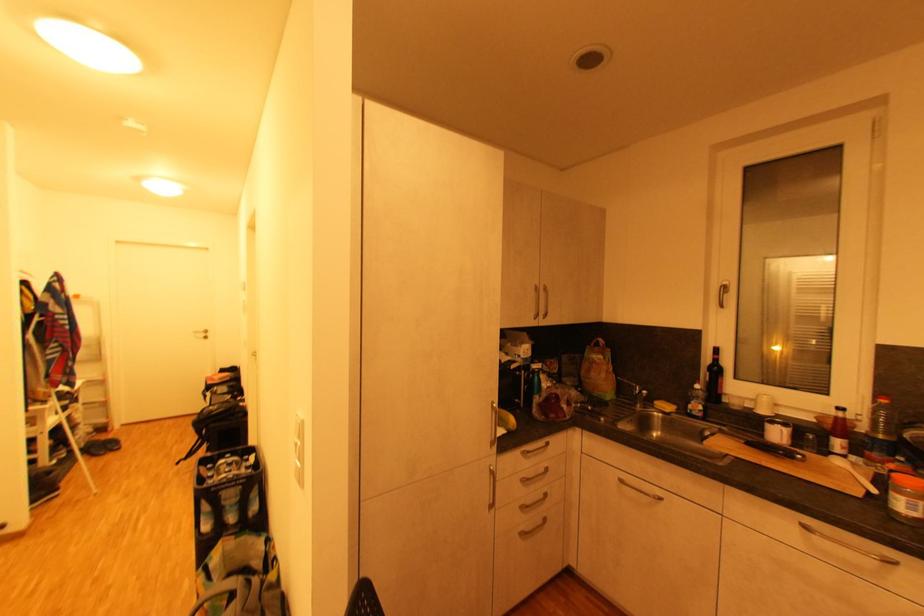
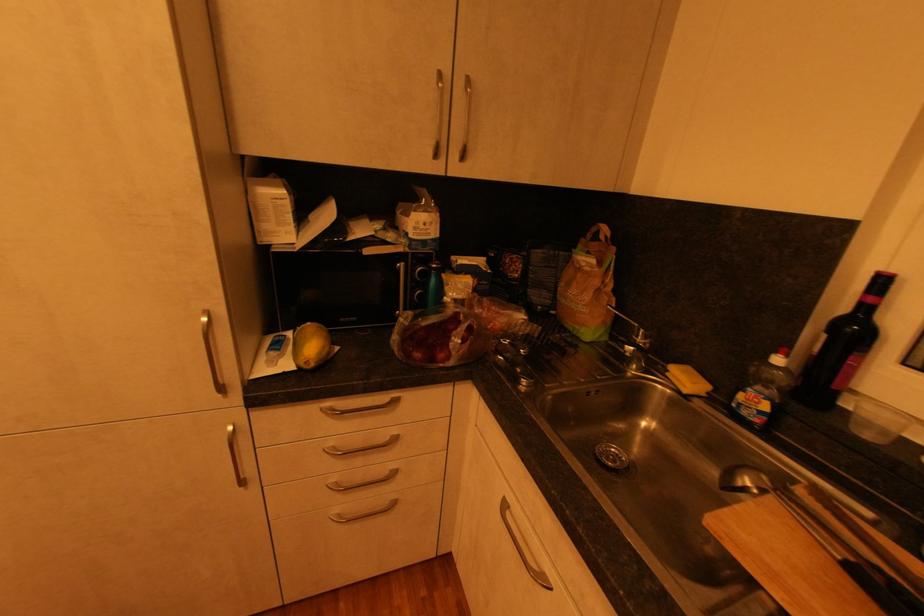
The point at (x=638, y=386) is marked in the first image. Where is the corresponding point in the second image?

(638, 326)